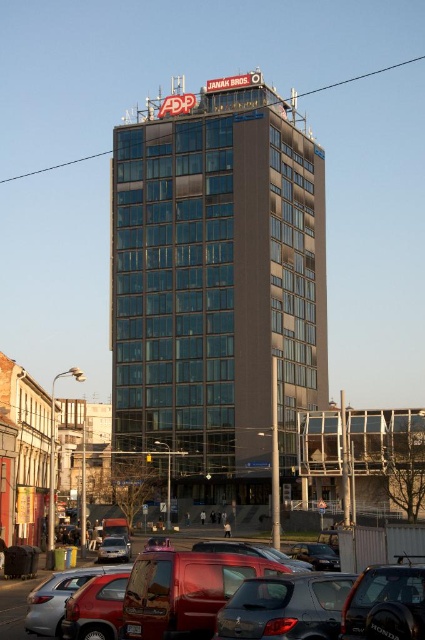
Consider the image. Which is more to the right, transparent glass building at center or matte black car at center?

transparent glass building at center

Does transparent glass building at center appear under matte black car at center?

Correct, transparent glass building at center is located below matte black car at center.

At what (x,y) coordinates should I click in order to perform the action: click on transparent glass building at center. Please return your answer as a coordinate pair (x, y). This screenshot has width=425, height=640. Looking at the image, I should click on (367, 451).

Who is more distant from viewer, [34,404] or [181,541]?

Positioned behind is point [181,541].

Identify the location of matte gray building at lower left. (25, 451).

Between point (308, 458) and point (399, 524), which one is positioned behind?

Point (308, 458)

Which is in front, point (419, 476) or point (357, 566)?

Point (357, 566)

Between point (311, 467) and point (343, 557), which one is positioned behind?

Positioned behind is point (311, 467).

This screenshot has height=640, width=425. I want to click on transparent glass building at center, so click(x=367, y=451).